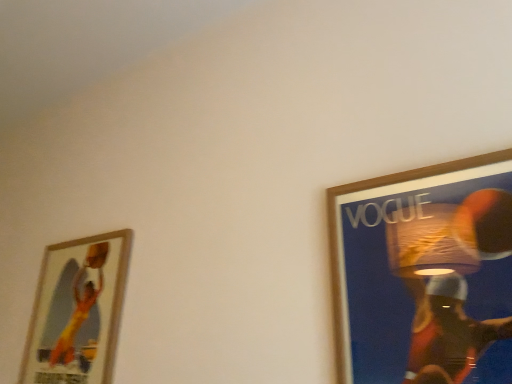
Question: From a real-world perspective, does wooden framed poster at left, which ranks as the second picture frame in front-to-back order, stand above wooden picture frame at upper right, the second picture frame in the back-to-front sequence?

Choices:
 (A) yes
 (B) no

Answer: (A)

Question: Considering the relative sizes of wooden framed poster at left, the second picture frame in the right-to-left sequence, and wooden picture frame at upper right, arranged as the first picture frame when viewed from the right, in the image provided, is wooden framed poster at left, the second picture frame in the right-to-left sequence, thinner than wooden picture frame at upper right, arranged as the first picture frame when viewed from the right,?

Choices:
 (A) no
 (B) yes

Answer: (A)

Question: Considering the relative sizes of wooden framed poster at left, which ranks as the second picture frame in front-to-back order, and wooden picture frame at upper right, arranged as the first picture frame when viewed from the right, in the image provided, is wooden framed poster at left, which ranks as the second picture frame in front-to-back order, shorter than wooden picture frame at upper right, arranged as the first picture frame when viewed from the right,?

Choices:
 (A) yes
 (B) no

Answer: (B)

Question: Can you confirm if wooden framed poster at left, which is the first picture frame in left-to-right order, is wider than wooden picture frame at upper right, the second picture frame in the back-to-front sequence?

Choices:
 (A) no
 (B) yes

Answer: (B)

Question: From the image's perspective, is wooden framed poster at left, which ranks as the second picture frame in front-to-back order, beneath wooden picture frame at upper right, arranged as the first picture frame when viewed from the right?

Choices:
 (A) yes
 (B) no

Answer: (A)

Question: Can you confirm if wooden framed poster at left, the second picture frame in the right-to-left sequence, is positioned to the left of wooden picture frame at upper right, the 2th picture frame from the left?

Choices:
 (A) yes
 (B) no

Answer: (A)

Question: Is wooden picture frame at upper right, arranged as the first picture frame when viewed from the right, shorter than wooden framed poster at left, the first picture frame viewed from the back?

Choices:
 (A) no
 (B) yes

Answer: (B)

Question: Considering the relative sizes of wooden picture frame at upper right, the second picture frame in the back-to-front sequence, and wooden framed poster at left, which is the first picture frame in left-to-right order, in the image provided, is wooden picture frame at upper right, the second picture frame in the back-to-front sequence, thinner than wooden framed poster at left, which is the first picture frame in left-to-right order,?

Choices:
 (A) yes
 (B) no

Answer: (A)

Question: From a real-world perspective, is wooden picture frame at upper right, which is the first picture frame in front-to-back order, below wooden framed poster at left, which ranks as the second picture frame in front-to-back order?

Choices:
 (A) yes
 (B) no

Answer: (A)

Question: Does wooden picture frame at upper right, the second picture frame in the back-to-front sequence, come behind wooden framed poster at left, which is the first picture frame in left-to-right order?

Choices:
 (A) no
 (B) yes

Answer: (A)

Question: From a real-world perspective, is wooden picture frame at upper right, arranged as the first picture frame when viewed from the right, on top of wooden framed poster at left, which is the first picture frame in left-to-right order?

Choices:
 (A) no
 (B) yes

Answer: (A)

Question: Is wooden picture frame at upper right, which is the first picture frame in front-to-back order, oriented away from wooden framed poster at left, the second picture frame in the right-to-left sequence?

Choices:
 (A) yes
 (B) no

Answer: (B)

Question: Is point (105, 273) positioned closer to the camera than point (415, 205)?

Choices:
 (A) farther
 (B) closer

Answer: (A)